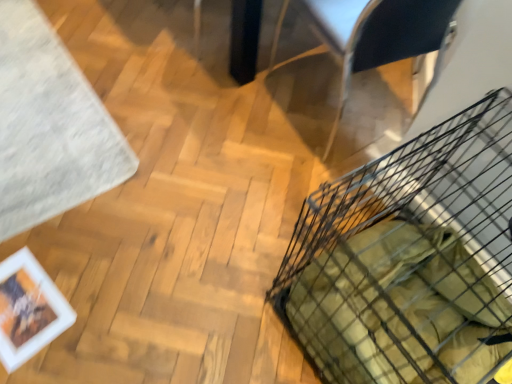
Locate an element on the screen. This screenshot has width=512, height=384. vacant area to the right of white matte picture frame at lower left is located at coordinates (93, 311).